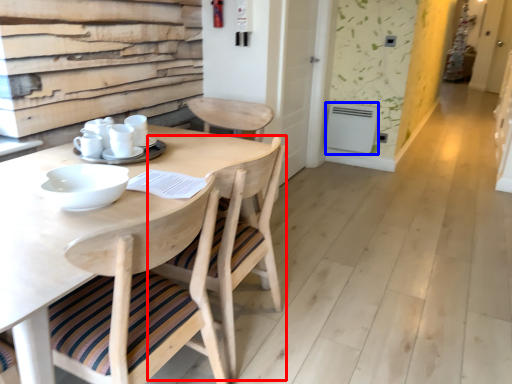
Question: Which point is further to the camera, chair (highlighted by a red box) or appliance (highlighted by a blue box)?

Choices:
 (A) chair
 (B) appliance

Answer: (B)